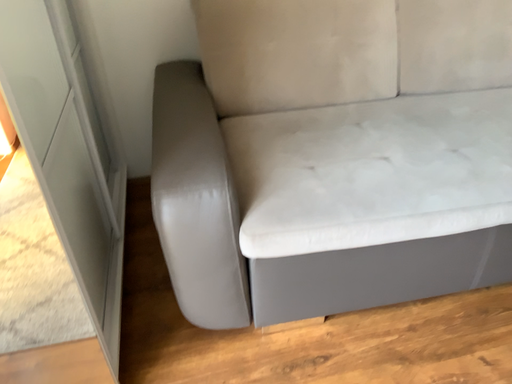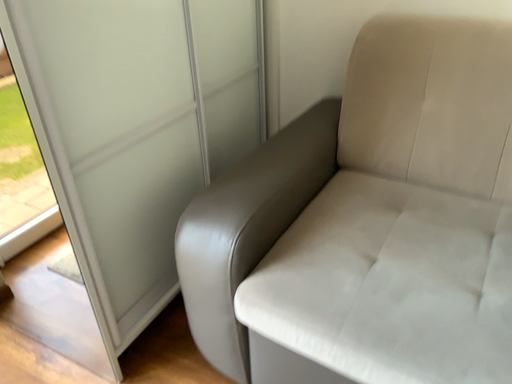
Question: Which way did the camera rotate in the video?

Choices:
 (A) rotated right
 (B) rotated left

Answer: (B)